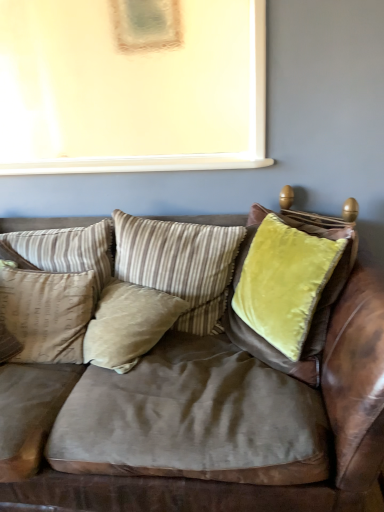
Question: Is point (124, 338) closer or farther from the camera than point (66, 323)?

Choices:
 (A) farther
 (B) closer

Answer: (B)

Question: In terms of width, does beige velvet pillow at center, placed as the second pillow when sorted from right to left, look wider or thinner when compared to beige fabric pillow at left, acting as the 4th pillow starting from the right?

Choices:
 (A) thin
 (B) wide

Answer: (B)

Question: Estimate the real-world distances between objects in this image. Which object is farther from the beige velvet pillow at center, placed as the second pillow when sorted from right to left?

Choices:
 (A) striped fabric pillow at center, positioned as the fourth pillow in left-to-right order
 (B) velvet brown couch at center
 (C) beige fabric pillow at left, acting as the 4th pillow starting from the right
 (D) beige striped pillow at center, acting as the third pillow starting from the right

Answer: (D)

Question: Estimate the real-world distances between objects in this image. Which object is farther from the velvet brown couch at center?

Choices:
 (A) beige fabric pillow at left, arranged as the 1th pillow when viewed from the left
 (B) striped fabric pillow at center, positioned as the fourth pillow in left-to-right order
 (C) beige velvet pillow at center, placed as the second pillow when sorted from right to left
 (D) beige striped pillow at center, marked as the second pillow in a left-to-right arrangement

Answer: (D)